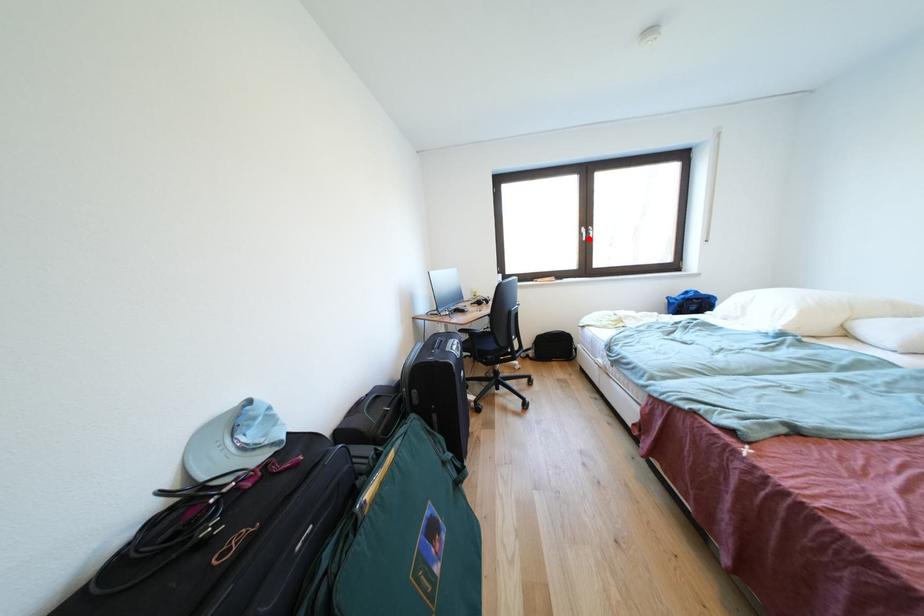
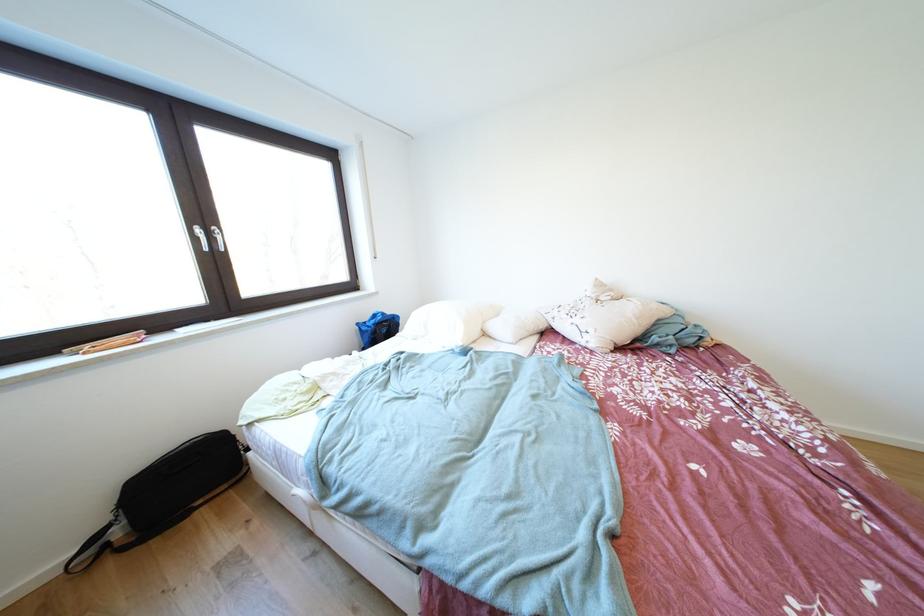
Question: I am providing you with two images of the same scene from different viewpoints. Given a red point in image1, look at the same physical point in image2. Is it:

Choices:
 (A) Closer to the viewpoint
 (B) Farther from the viewpoint

Answer: (B)